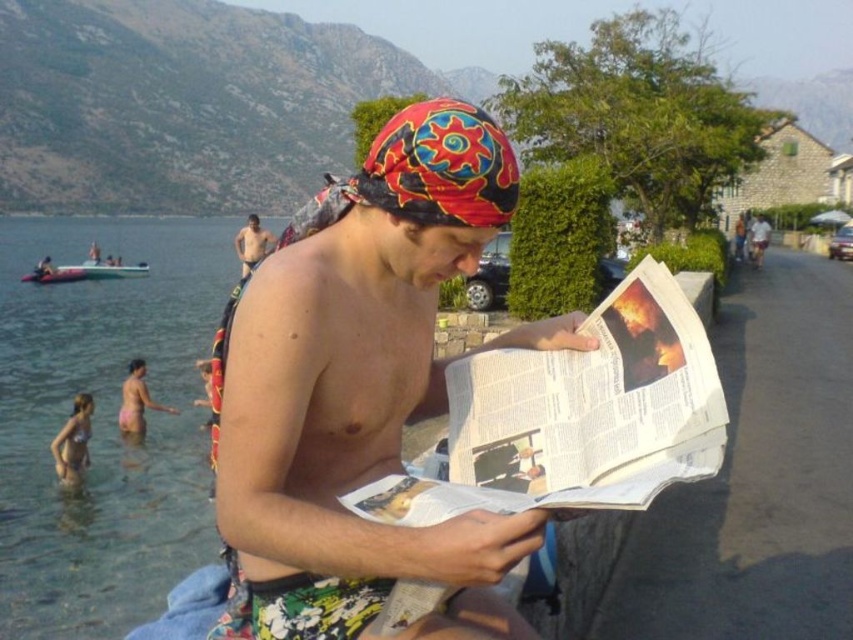
What are the coordinates of the white paper at center?

Answer: The white paper at center is located at point (592, 406).

You are a photographer at the beach and want to capture a photo of the beige bikini at lower left and pink fabric bikini at lower left. Which one is closer to the camera?

The beige bikini at lower left is in front of the pink fabric bikini at lower left, so it is closer to the camera.